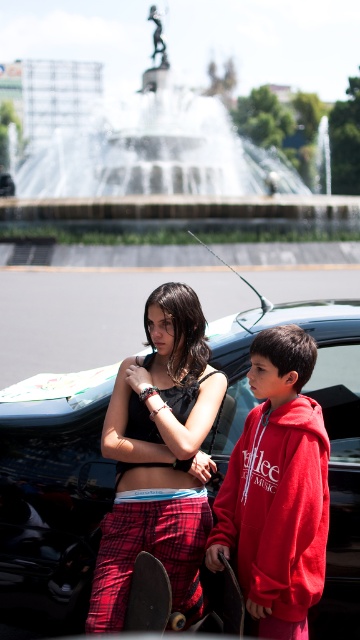
Question: Can you confirm if matte black tank top at center is thinner than matte red hoodie at center?

Choices:
 (A) yes
 (B) no

Answer: (B)

Question: Where is black matte skateboard at lower left located in relation to black smooth skateboard at lower center in the image?

Choices:
 (A) right
 (B) left

Answer: (B)

Question: Which of the following is the farthest from the observer?

Choices:
 (A) matte black tank top at center
 (B) shiny black car at center
 (C) matte red hoodie at center

Answer: (B)

Question: Which of the following is the closest to the observer?

Choices:
 (A) (231, 586)
 (B) (105, 26)
 (C) (165, 403)
 (D) (258, 353)

Answer: (A)

Question: Is shiny black car at center wider than black matte skateboard at lower left?

Choices:
 (A) no
 (B) yes

Answer: (B)

Question: Which point is closer to the camera?

Choices:
 (A) (316, 467)
 (B) (127, 376)
 (C) (84, 518)

Answer: (A)